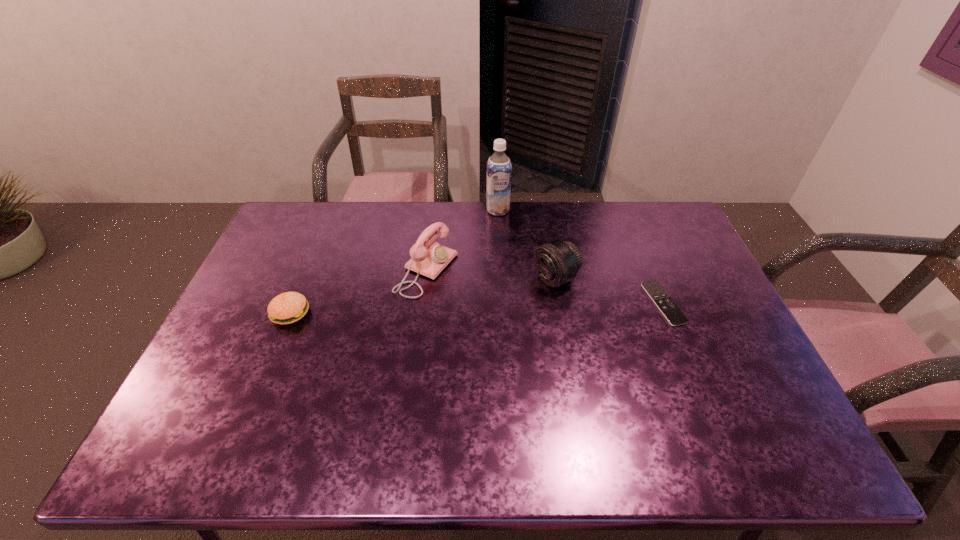
Identify the location of object located in the left edge section of the desktop. (289, 307).

Identify the location of object that is at the right edge. (675, 317).

Locate an element on the screen. The width and height of the screenshot is (960, 540). free space at the far edge is located at coordinates (554, 206).

The width and height of the screenshot is (960, 540). I want to click on vacant region at the near edge, so click(x=292, y=391).

The image size is (960, 540). In the image, there is a desktop. Identify the location of vacant space at the right edge. (699, 374).

At what (x,y) coordinates should I click in order to perform the action: click on free region at the far left corner of the desktop. Please return your answer as a coordinate pair (x, y). Looking at the image, I should click on (288, 231).

You are a GUI agent. You are given a task and a screenshot of the screen. Output one action in this format:
    pyautogui.click(x=<x>, y=<y>)
    Task: Click on the free space at the far right corner of the desktop
    
    Given the screenshot: What is the action you would take?
    pyautogui.click(x=654, y=221)

Image resolution: width=960 pixels, height=540 pixels. Identify the location of free space at the near right corner of the desktop. (755, 410).

The width and height of the screenshot is (960, 540). In order to click on vacant area that lies between the third object from right to left and the fourth tallest object in this screenshot , I will do `click(395, 262)`.

I want to click on free space that is in between the telephoto lens and the third object from right to left, so click(x=527, y=245).